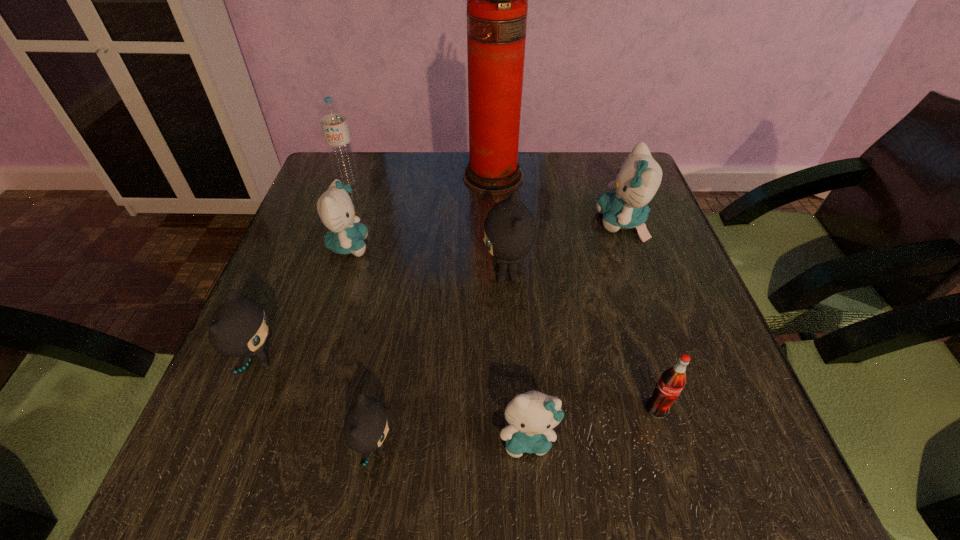
Locate an element on the screen. The width and height of the screenshot is (960, 540). vacant space that is in between the fire extinguisher and the second tallest object is located at coordinates pyautogui.click(x=420, y=179).

In order to click on vacant area that lies between the biggest blue kitten and the fire extinguisher in this screenshot , I will do `click(558, 199)`.

What are the coordinates of `free space between the nearest blue kitten and the second gray kitten from right to left` in the screenshot? It's located at (451, 442).

Where is `empty location between the soda bottle and the leftmost kitten`? This screenshot has height=540, width=960. empty location between the soda bottle and the leftmost kitten is located at coordinates (458, 384).

Where is `free space that is in between the sixth farthest object and the biggest gray kitten`? free space that is in between the sixth farthest object and the biggest gray kitten is located at coordinates click(x=383, y=317).

You are a GUI agent. You are given a task and a screenshot of the screen. Output one action in this format:
    pyautogui.click(x=<x>, y=<y>)
    Task: Click on the unoccupied area between the rightmost kitten and the fire extinguisher
    The height and width of the screenshot is (540, 960).
    Given the screenshot: What is the action you would take?
    pyautogui.click(x=558, y=199)

I want to click on unoccupied position between the third kitten from left to right and the rightmost kitten, so click(498, 335).

At what (x,y) coordinates should I click in order to perform the action: click on free spot between the rightmost blue kitten and the leftmost kitten. Please return your answer as a coordinate pair (x, y). Looking at the image, I should click on (441, 292).

You are a GUI agent. You are given a task and a screenshot of the screen. Output one action in this format:
    pyautogui.click(x=<x>, y=<y>)
    Task: Click on the vacant region between the water bottle and the second blue kitten from left to right
    
    Given the screenshot: What is the action you would take?
    pyautogui.click(x=438, y=310)

This screenshot has width=960, height=540. Find the location of `the seventh closest object to the fifth kitten from right to left`. the seventh closest object to the fifth kitten from right to left is located at coordinates (639, 177).